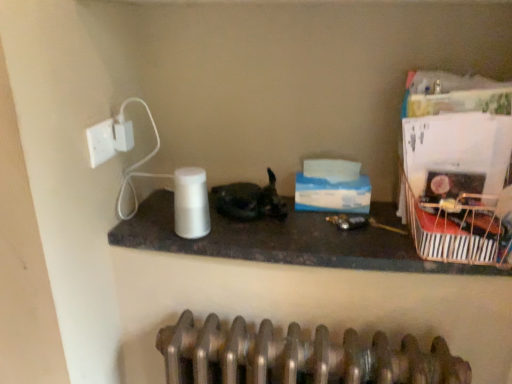
Locate an element on the screen. This screenshot has height=384, width=512. free space in front of shiny black cat at center is located at coordinates (257, 233).